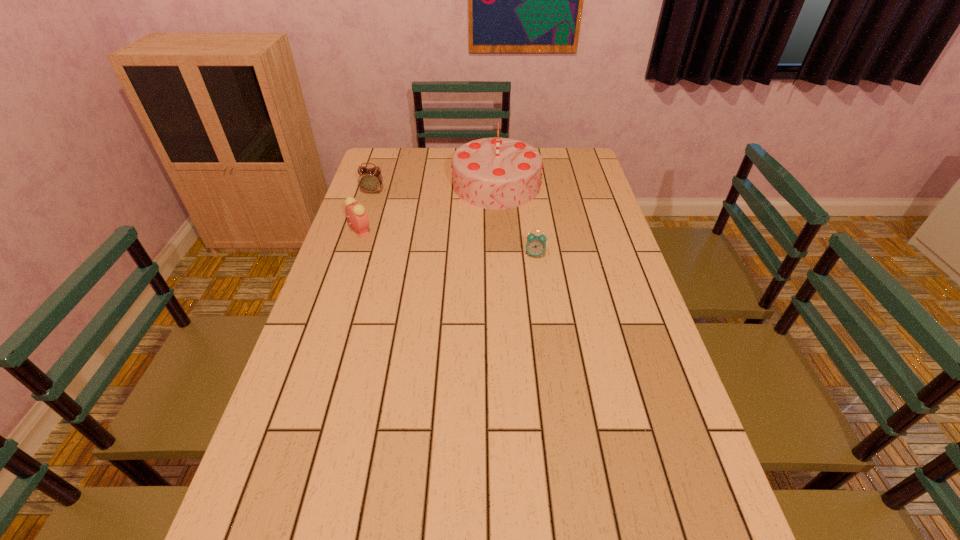
Locate an element on the screen. vacant area that lies between the farthest alarm clock and the tallest object is located at coordinates (435, 188).

Identify the location of vacant region between the second farthest alarm clock and the tallest object. (428, 208).

Where is `vacant area that lies between the tallest object and the nearest alarm clock`? The height and width of the screenshot is (540, 960). vacant area that lies between the tallest object and the nearest alarm clock is located at coordinates (516, 220).

Locate an element on the screen. object that stands as the second closest to the birthday cake is located at coordinates (370, 180).

You are a GUI agent. You are given a task and a screenshot of the screen. Output one action in this format:
    pyautogui.click(x=<x>, y=<y>)
    Task: Click on the object that stands as the second closest to the tallest object
    This screenshot has height=540, width=960.
    Given the screenshot: What is the action you would take?
    pyautogui.click(x=370, y=180)

The height and width of the screenshot is (540, 960). I want to click on alarm clock that is the second nearest to the farthest alarm clock, so click(536, 245).

Identify which alarm clock is the second nearest to the nearest alarm clock. Please provide its 2D coordinates. Your answer should be formatted as a tuple, i.e. [(x, y)], where the tuple contains the x and y coordinates of a point satisfying the conditions above.

[(370, 180)]

Where is `vacant point that satisfies the following two spatial constraints: 1. on the front side of the tallest object; 2. on the face of the second farthest alarm clock`? vacant point that satisfies the following two spatial constraints: 1. on the front side of the tallest object; 2. on the face of the second farthest alarm clock is located at coordinates (499, 231).

Identify the location of vacant space that satisfies the following two spatial constraints: 1. on the face of the farthest alarm clock; 2. on the face of the third farthest object. Image resolution: width=960 pixels, height=540 pixels. (360, 231).

Image resolution: width=960 pixels, height=540 pixels. I want to click on vacant space that satisfies the following two spatial constraints: 1. on the front side of the tallest object; 2. on the face of the second nearest alarm clock, so click(x=499, y=231).